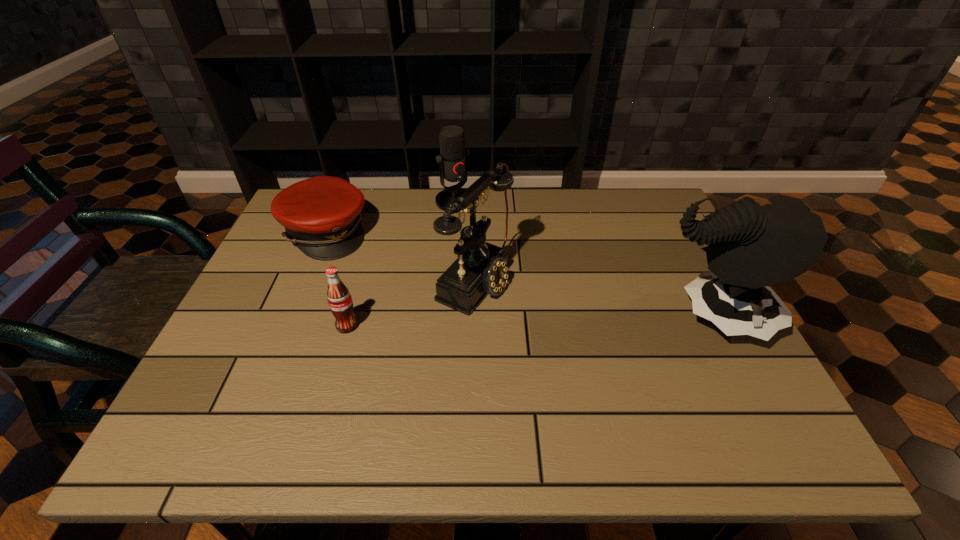
The width and height of the screenshot is (960, 540). I want to click on free space at the far edge of the desktop, so click(x=420, y=219).

Find the location of a particular element. vacant space at the left edge of the desktop is located at coordinates (273, 253).

Where is `blank space at the right edge`? Image resolution: width=960 pixels, height=540 pixels. blank space at the right edge is located at coordinates (670, 260).

The image size is (960, 540). In the image, there is a desktop. In order to click on free space at the near left corner in this screenshot , I will do `click(248, 403)`.

I want to click on vacant space at the far right corner of the desktop, so click(x=664, y=211).

Identify the location of blank area at the near right corner. (709, 372).

Identify the location of free area in between the third shortest object and the shortest object. (391, 217).

Locate an element on the screen. The image size is (960, 540). blank region between the second shortest object and the microphone is located at coordinates (401, 264).

Where is `free space between the doll and the second tallest object`? free space between the doll and the second tallest object is located at coordinates (592, 298).

What are the coordinates of `vacant area that lies between the second shortest object and the fourth shortest object` in the screenshot? It's located at (411, 301).